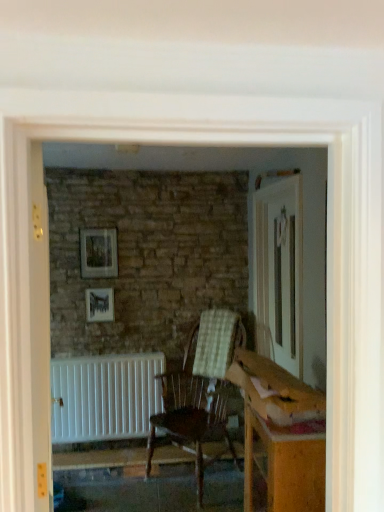
Question: From the image's perspective, is matte black picture frame at upper center, which is the first picture frame in bottom-to-top order, over wooden frame at upper center, the 2th picture frame when ordered from bottom to top?

Choices:
 (A) yes
 (B) no

Answer: (B)

Question: Does matte black picture frame at upper center, which is the first picture frame in bottom-to-top order, have a smaller size compared to wooden frame at upper center, the 2th picture frame when ordered from bottom to top?

Choices:
 (A) no
 (B) yes

Answer: (B)

Question: Is matte black picture frame at upper center, which is the first picture frame in bottom-to-top order, shorter than wooden frame at upper center, the 2th picture frame when ordered from bottom to top?

Choices:
 (A) yes
 (B) no

Answer: (A)

Question: From a real-world perspective, is matte black picture frame at upper center, which is the first picture frame in bottom-to-top order, on wooden frame at upper center, the 2th picture frame when ordered from bottom to top?

Choices:
 (A) no
 (B) yes

Answer: (A)

Question: From the image's perspective, is matte black picture frame at upper center, which is the first picture frame in bottom-to-top order, below wooden frame at upper center, which is counted as the 1th picture frame, starting from the top?

Choices:
 (A) yes
 (B) no

Answer: (A)

Question: Is matte black picture frame at upper center, which is the first picture frame in bottom-to-top order, not within wooden frame at upper center, the 2th picture frame when ordered from bottom to top?

Choices:
 (A) yes
 (B) no

Answer: (A)

Question: From a real-world perspective, does white matte radiator at lower left sit lower than matte black picture frame at upper center, which is the first picture frame in bottom-to-top order?

Choices:
 (A) no
 (B) yes

Answer: (B)

Question: Is white matte radiator at lower left aimed at matte black picture frame at upper center, the second picture frame viewed from the top?

Choices:
 (A) no
 (B) yes

Answer: (A)

Question: Is white matte radiator at lower left positioned with its back to matte black picture frame at upper center, which is the first picture frame in bottom-to-top order?

Choices:
 (A) yes
 (B) no

Answer: (B)

Question: Can you confirm if white matte radiator at lower left is bigger than matte black picture frame at upper center, the second picture frame viewed from the top?

Choices:
 (A) no
 (B) yes

Answer: (B)

Question: Does white matte radiator at lower left have a greater height compared to matte black picture frame at upper center, the second picture frame viewed from the top?

Choices:
 (A) yes
 (B) no

Answer: (A)

Question: Can you confirm if white matte radiator at lower left is positioned to the right of matte black picture frame at upper center, which is the first picture frame in bottom-to-top order?

Choices:
 (A) yes
 (B) no

Answer: (A)

Question: Considering the relative sizes of wooden chair with checkered cushion at center and wooden frame at upper center, which is counted as the 1th picture frame, starting from the top, in the image provided, is wooden chair with checkered cushion at center bigger than wooden frame at upper center, which is counted as the 1th picture frame, starting from the top,?

Choices:
 (A) yes
 (B) no

Answer: (A)